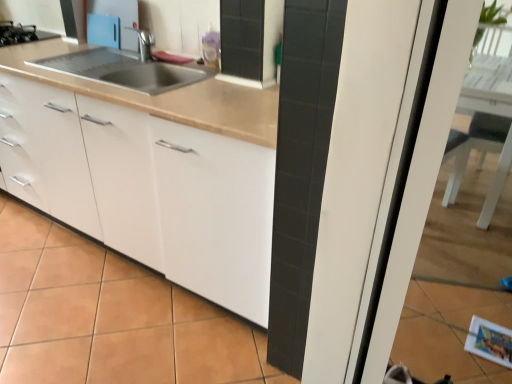
Find the location of a particular element. black matte gas stove at upper left is located at coordinates (21, 34).

What is the approximate height of black matte gas stove at upper left?

black matte gas stove at upper left is 6.16 centimeters in height.

The image size is (512, 384). Describe the element at coordinates (21, 34) in the screenshot. I see `black matte gas stove at upper left` at that location.

The image size is (512, 384). In order to click on black matte gas stove at upper left in this screenshot , I will do `click(21, 34)`.